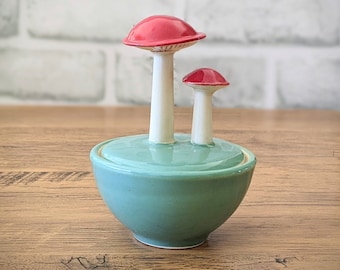
Locate an element on the screen. Image resolution: width=340 pixels, height=270 pixels. wood table topq is located at coordinates (57, 237).